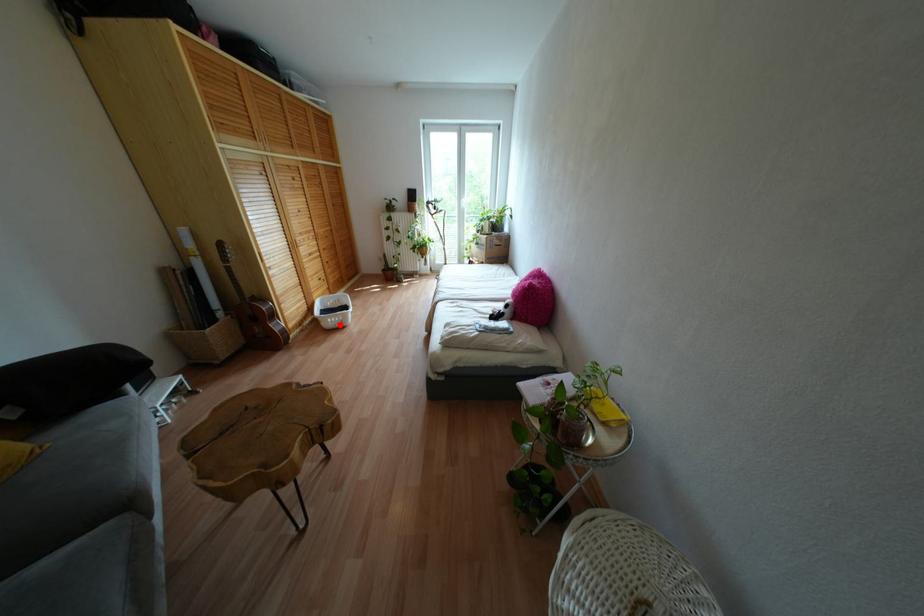
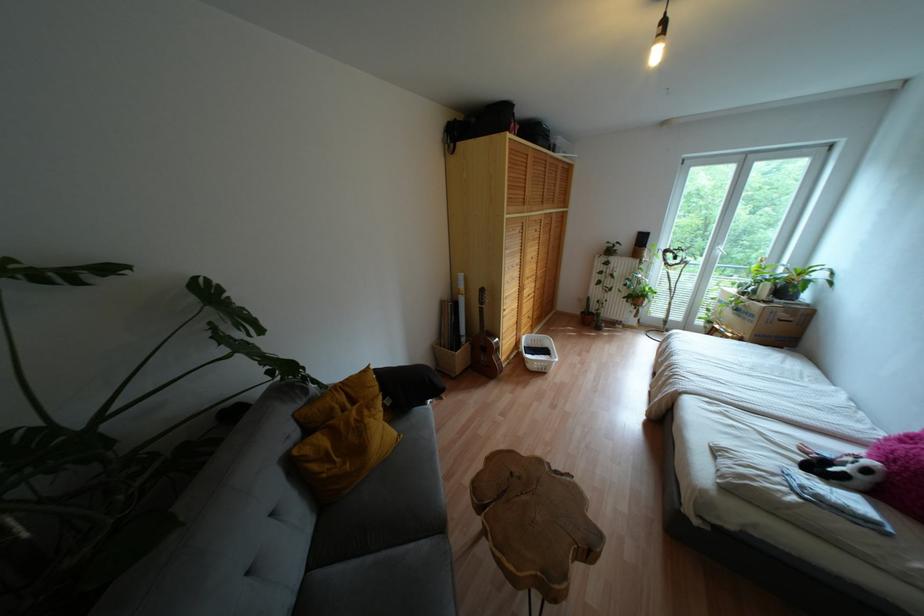
Find the pixel in the second image that matches the highlighted location in the first image.

(542, 370)